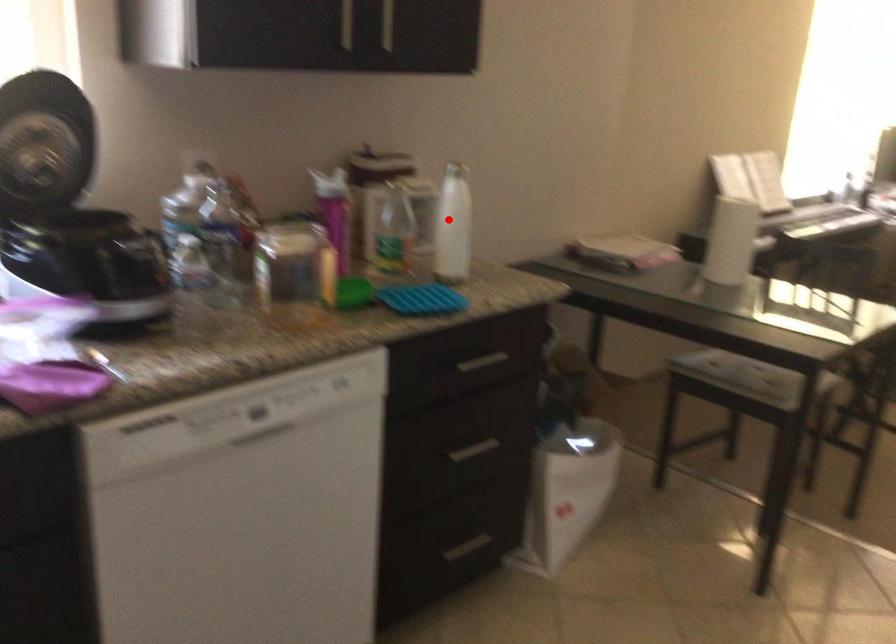
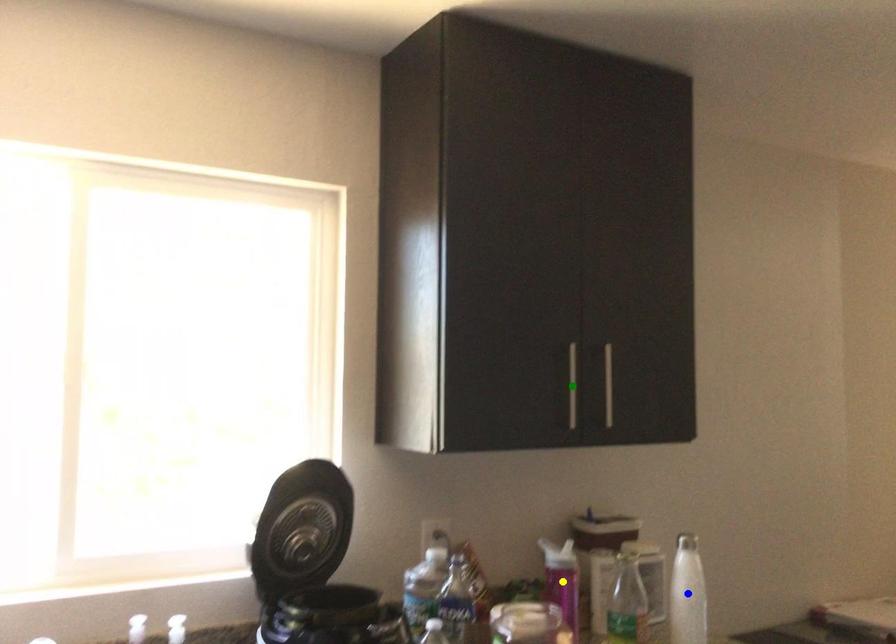
Question: I am providing you with two images of the same scene from different viewpoints. A red point is marked on the first image. You are given multiple points on the second image. In image 2, which mark is for the same physical point as the one in image 1?

Choices:
 (A) blue point
 (B) yellow point
 (C) green point

Answer: (A)